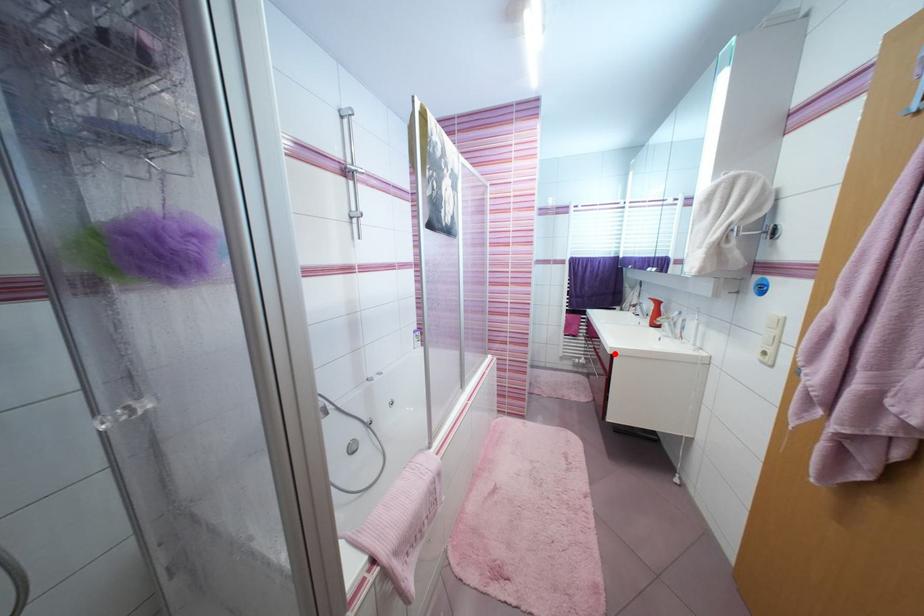
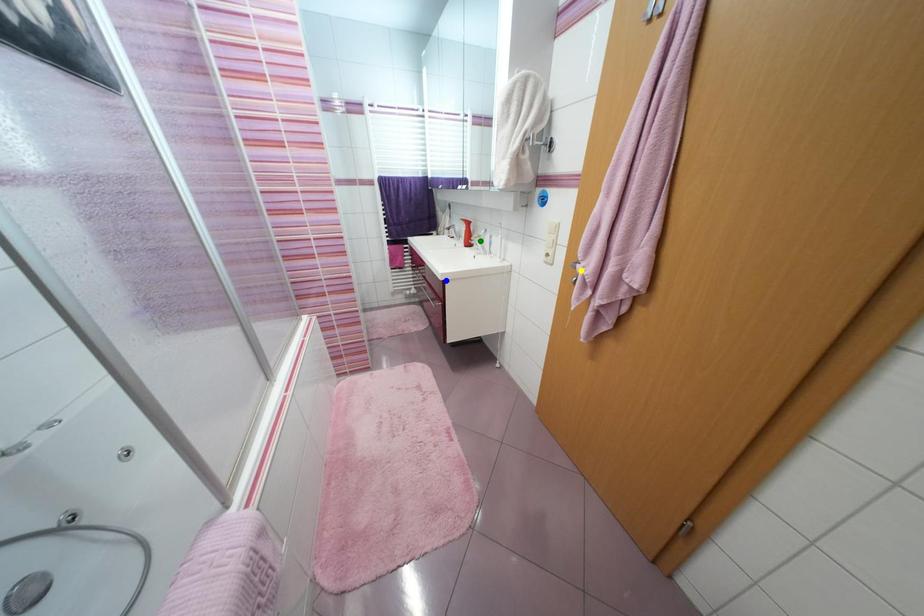
Question: I am providing you with two images of the same scene from different viewpoints. A red point is marked on the first image. You are given multiple points on the second image. Which point in image 2 represents the same 3d spot as the red point in image 1?

Choices:
 (A) yellow point
 (B) blue point
 (C) green point

Answer: (B)